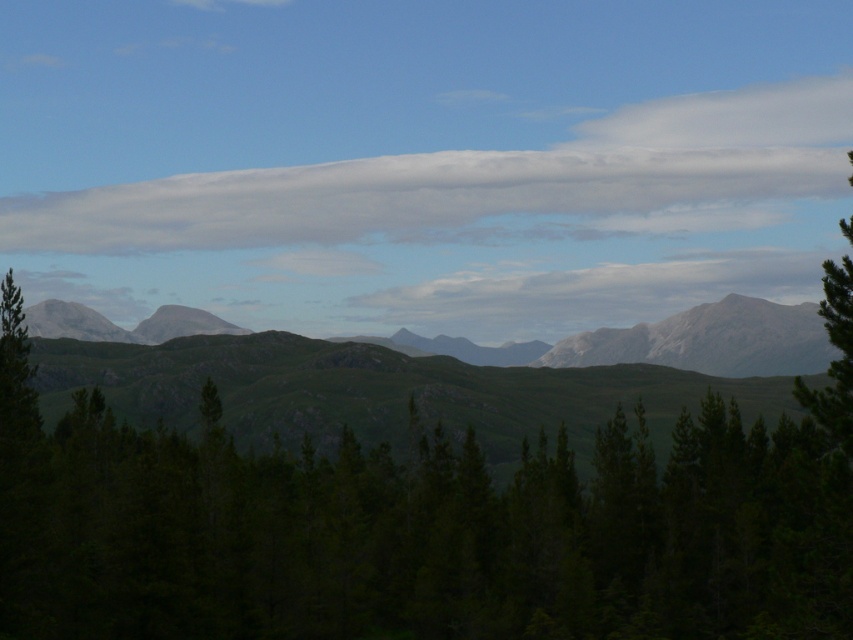
You are a photographer planning to capture the white fluffy cloud at upper center and the gray rock mountain range at center in the same frame. Based on their sizes, which object would likely occupy more space in your photo?

The white fluffy cloud at upper center might occupy more space in the photo since it might be wider than the gray rock mountain range at center according to the description.

You are a hiker planning to take a photo of the gray rock mountain range at center and the gray rocky mountains at center. Which mountain is located to the right side of the other?

The gray rock mountain range at center is positioned on the right side of gray rocky mountains at center.